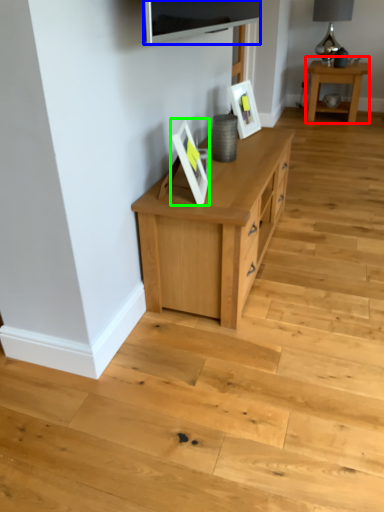
Question: Which object is the closest to the table (highlighted by a red box)? Choose among these: television (highlighted by a blue box) or picture frame (highlighted by a green box).

Choices:
 (A) television
 (B) picture frame

Answer: (A)